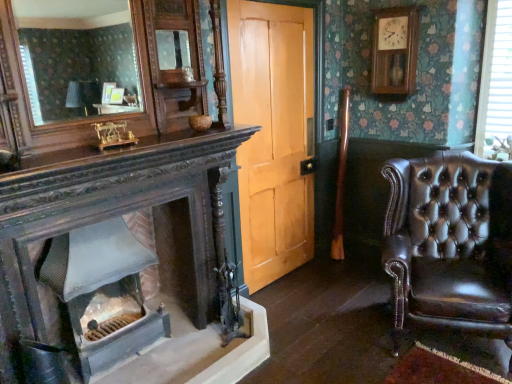
This screenshot has height=384, width=512. Find the location of `vacant space in front of light brown wood door at center`. vacant space in front of light brown wood door at center is located at coordinates (309, 317).